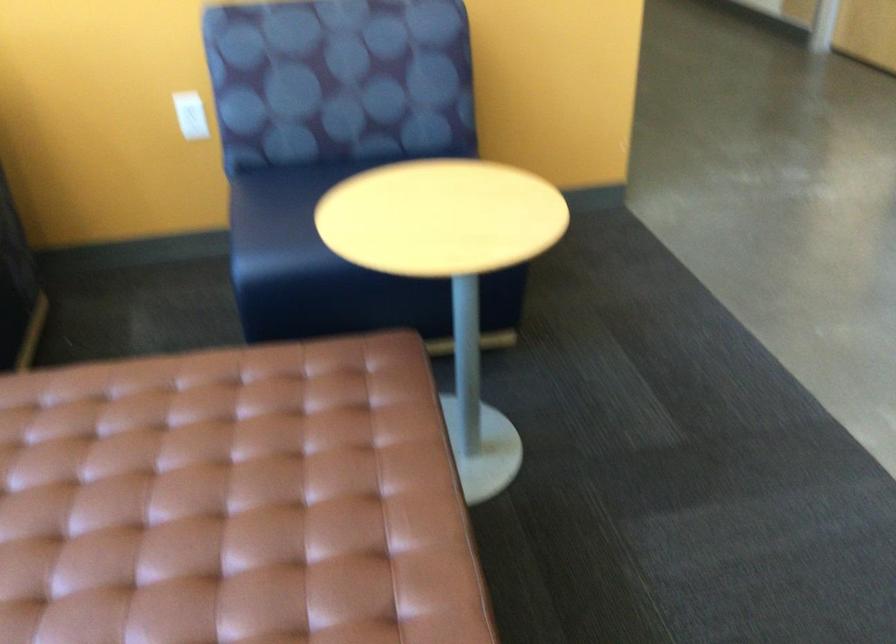
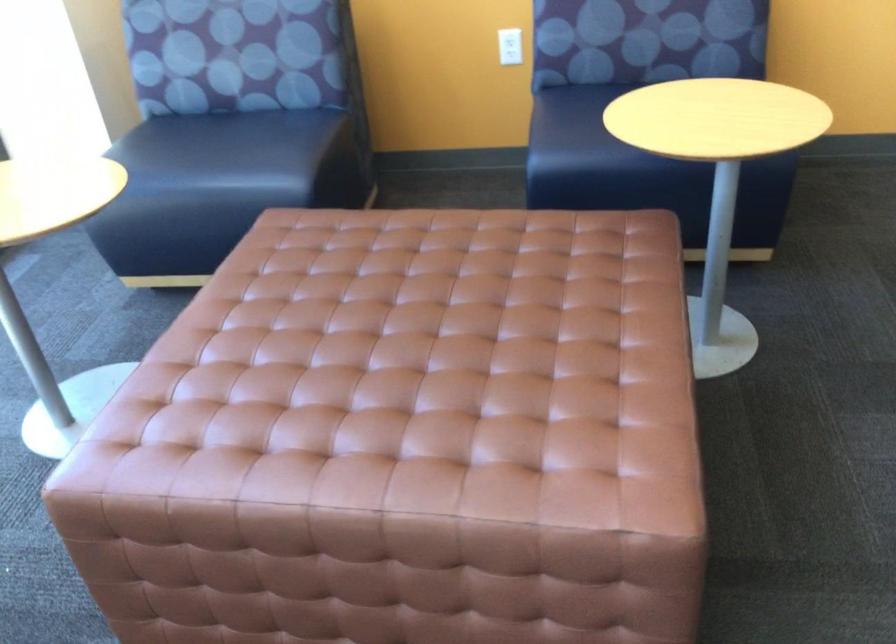
Locate, in the second image, the point that corresponds to the point at 190,120 in the first image.

(510, 46)